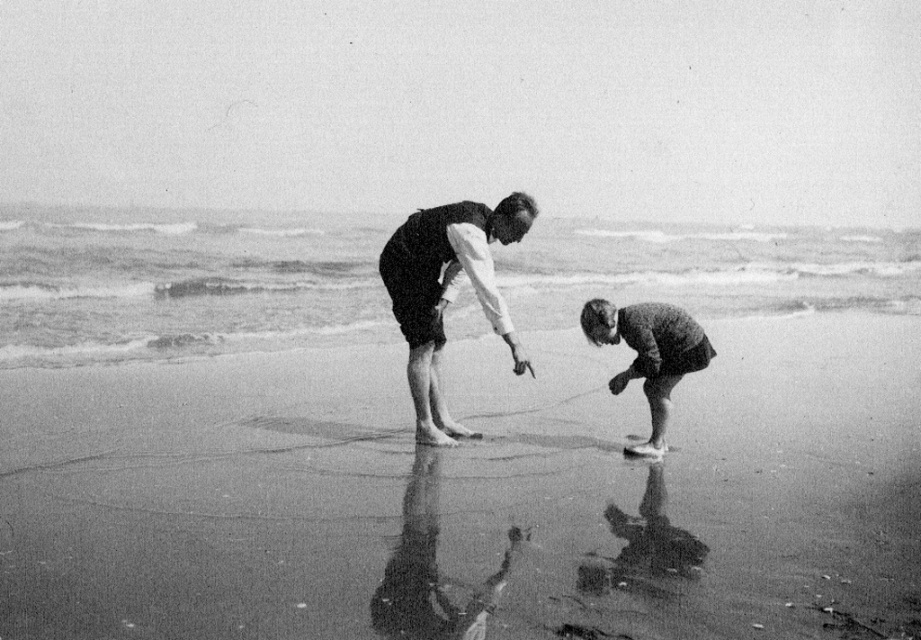
You are a photographer analyzing the composition of this black and white beach scene. Based on the positions of the smooth sand at lower center and smooth fabric shorts at center, where would you place the horizon line in relation to these two elements?

The smooth sand at lower center is below the smooth fabric shorts at center, so the horizon line would be above the smooth fabric shorts at center.

You are trying to decide whether to place a small bucket on the smooth sand at lower center or the smooth fabric shorts at center. Based on their widths, which location can accommodate the bucket more comfortably?

The smooth sand at lower center might be wider than smooth fabric shorts at center, so placing the bucket on the smooth sand at lower center would likely be more comfortable and stable.

From the picture: You are a photographer trying to capture a detailed shot of the smooth fabric shorts at center and the coarse wool sweater at lower right. Which object should you focus on first if you want to ensure both are in focus without moving the camera?

The smooth fabric shorts at center should be focused on first because it is positioned over the coarse wool sweater at lower right, meaning it is closer to the camera. By focusing on the closer object, the farther one may still be within the depth of field, ensuring both are in focus.